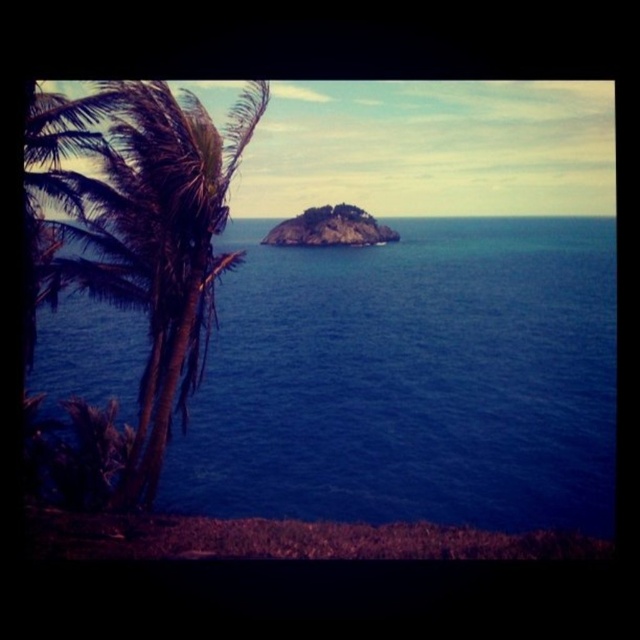
From the picture: Who is lower down, green leafy palm tree at left or brown grass at lower center?

Positioned lower is brown grass at lower center.

Which is in front, point (132, 168) or point (100, 545)?

Positioned in front is point (100, 545).

Who is more forward, (116,108) or (252,522)?

Point (252,522)

What are the coordinates of `green leafy palm tree at left` in the screenshot? It's located at (x=157, y=243).

Between brown grass at lower center and green mossy rock at center, which one has more height?

green mossy rock at center is taller.

You are a GUI agent. You are given a task and a screenshot of the screen. Output one action in this format:
    pyautogui.click(x=<x>, y=<y>)
    Task: Click on the brown grass at lower center
    This screenshot has height=640, width=640.
    Given the screenshot: What is the action you would take?
    pyautogui.click(x=285, y=538)

Is blue liquid water at center shorter than green mossy rock at center?

In fact, blue liquid water at center may be taller than green mossy rock at center.

Does blue liquid water at center have a greater width compared to green mossy rock at center?

Indeed, blue liquid water at center has a greater width compared to green mossy rock at center.

What do you see at coordinates (412, 380) in the screenshot?
I see `blue liquid water at center` at bounding box center [412, 380].

The width and height of the screenshot is (640, 640). I want to click on blue liquid water at center, so click(x=412, y=380).